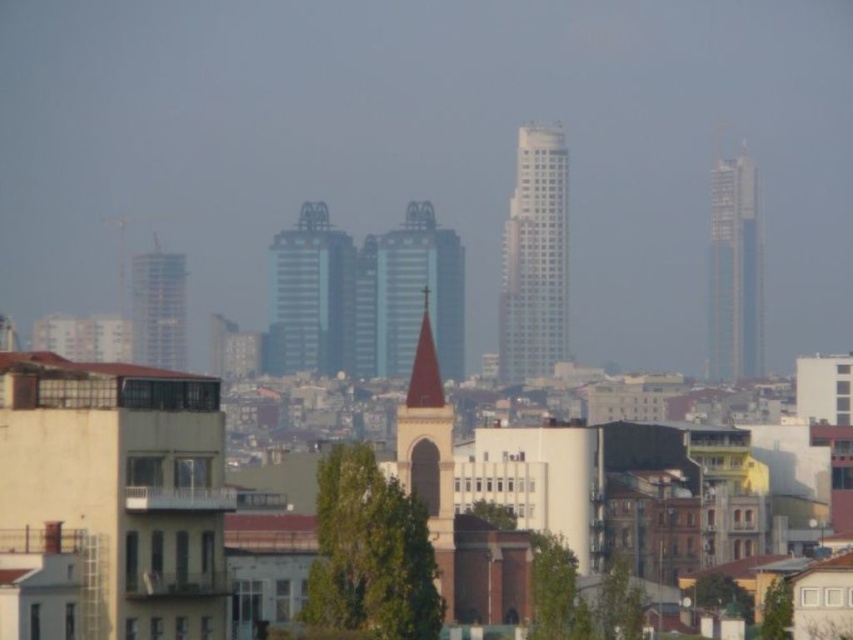
You are standing at the point with coordinates point (x=428, y=454) in the cityscape. What is the closest major landmark you can see from there?

The point (x=428, y=454) corresponds to the brown stone church steeple at center, so the closest major landmark you can see from there is the brown stone church steeple at center.

You are an architect analyzing the cityscape. You need to determine the relative positioning of the white glass tower at center and the brown stone church steeple at center. Based on the scene, which structure is positioned to the right of the other?

The white glass tower at center is to the right of the brown stone church steeple at center.